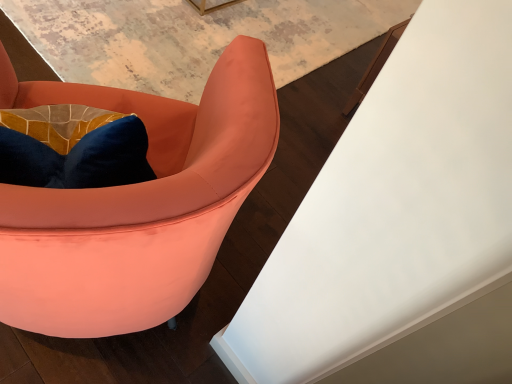
What is the approximate width of satin peach armchair at left?

satin peach armchair at left is 28.46 inches wide.

The height and width of the screenshot is (384, 512). In order to click on satin peach armchair at left in this screenshot , I will do `click(136, 204)`.

The image size is (512, 384). What do you see at coordinates (136, 204) in the screenshot? I see `satin peach armchair at left` at bounding box center [136, 204].

What do you see at coordinates (400, 225) in the screenshot? This screenshot has width=512, height=384. I see `white glossy table at upper right` at bounding box center [400, 225].

The width and height of the screenshot is (512, 384). In order to click on white glossy table at upper right in this screenshot , I will do `click(400, 225)`.

Locate an element on the screen. satin peach armchair at left is located at coordinates (136, 204).

Between white glossy table at upper right and satin peach armchair at left, which one appears on the right side from the viewer's perspective?

white glossy table at upper right is more to the right.

Relative to satin peach armchair at left, is white glossy table at upper right in front or behind?

Clearly, white glossy table at upper right is behind satin peach armchair at left.

Does point (223, 337) appear closer or farther from the camera than point (200, 251)?

Point (223, 337) appears to be farther away from the viewer than point (200, 251).

From the image's perspective, does white glossy table at upper right appear higher than satin peach armchair at left?

Yes.

From a real-world perspective, is white glossy table at upper right positioned over satin peach armchair at left based on gravity?

Actually, white glossy table at upper right is physically below satin peach armchair at left in the real world.

Which object is wider, white glossy table at upper right or satin peach armchair at left?

With larger width is white glossy table at upper right.

Is white glossy table at upper right taller than satin peach armchair at left?

Incorrect, the height of white glossy table at upper right is not larger of that of satin peach armchair at left.

Considering the relative sizes of white glossy table at upper right and satin peach armchair at left in the image provided, is white glossy table at upper right smaller than satin peach armchair at left?

Yes, white glossy table at upper right is smaller than satin peach armchair at left.

Is white glossy table at upper right outside of satin peach armchair at left?

Absolutely, white glossy table at upper right is external to satin peach armchair at left.

Consider the image. Is there a large distance between white glossy table at upper right and satin peach armchair at left?

Actually, white glossy table at upper right and satin peach armchair at left are a little close together.

Is white glossy table at upper right facing away from satin peach armchair at left?

No, white glossy table at upper right's orientation is not away from satin peach armchair at left.

How much distance is there between white glossy table at upper right and satin peach armchair at left?

The distance of white glossy table at upper right from satin peach armchair at left is 12.18 inches.

Where is `table on the right side of satin peach armchair at left`? The image size is (512, 384). table on the right side of satin peach armchair at left is located at coordinates (400, 225).

Which object is positioned more to the left, satin peach armchair at left or white glossy table at upper right?

satin peach armchair at left.

Considering their positions, is satin peach armchair at left located in front of or behind white glossy table at upper right?

satin peach armchair at left is positioned closer to the viewer than white glossy table at upper right.

Considering the points (242, 169) and (309, 335), which point is in front, point (242, 169) or point (309, 335)?

The point (242, 169) is more forward.

From the image's perspective, is satin peach armchair at left on top of white glossy table at upper right?

No, from the image's perspective, satin peach armchair at left is not above white glossy table at upper right.

From a real-world perspective, is satin peach armchair at left located higher than white glossy table at upper right?

Yes.

Considering the sizes of objects satin peach armchair at left and white glossy table at upper right in the image provided, who is thinner, satin peach armchair at left or white glossy table at upper right?

satin peach armchair at left is thinner.

Is satin peach armchair at left shorter than white glossy table at upper right?

In fact, satin peach armchair at left may be taller than white glossy table at upper right.

Does satin peach armchair at left have a larger size compared to white glossy table at upper right?

Yes.

Would you say white glossy table at upper right is part of satin peach armchair at left's contents?

No, white glossy table at upper right is not surrounded by satin peach armchair at left.

Is satin peach armchair at left far away from white glossy table at upper right?

No, satin peach armchair at left is in close proximity to white glossy table at upper right.

Is satin peach armchair at left positioned with its back to white glossy table at upper right?

No, satin peach armchair at left is not facing the opposite direction of white glossy table at upper right.

What's the angular difference between satin peach armchair at left and white glossy table at upper right's facing directions?

satin peach armchair at left and white glossy table at upper right are facing 47 degrees away from each other.

In order to click on chair that appears below the white glossy table at upper right (from the image's perspective) in this screenshot , I will do `click(136, 204)`.

At what (x,y) coordinates should I click in order to perform the action: click on chair on the left of white glossy table at upper right. Please return your answer as a coordinate pair (x, y). Looking at the image, I should click on (136, 204).

You are a GUI agent. You are given a task and a screenshot of the screen. Output one action in this format:
    pyautogui.click(x=<x>, y=<y>)
    Task: Click on the chair above the white glossy table at upper right (from a real-world perspective)
    This screenshot has height=384, width=512.
    Given the screenshot: What is the action you would take?
    pyautogui.click(x=136, y=204)